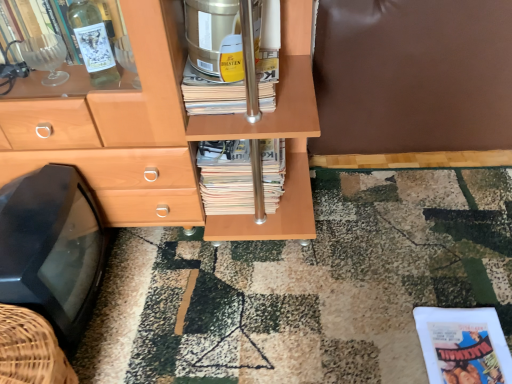
Image resolution: width=512 pixels, height=384 pixels. In order to click on vacant space behind matte white paperback book at lower right in this screenshot , I will do `click(433, 281)`.